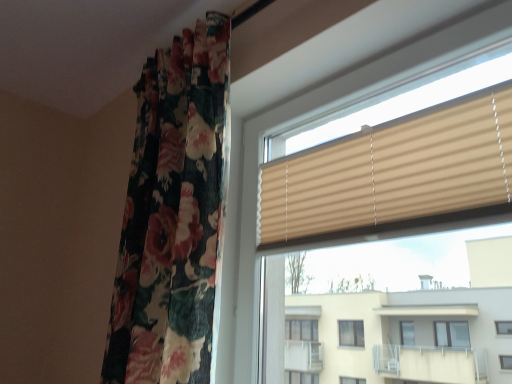
Question: In the image, is floral fabric curtain at left positioned in front of or behind beige ribbed blinds at center?

Choices:
 (A) behind
 (B) front

Answer: (A)

Question: In terms of height, does floral fabric curtain at left look taller or shorter compared to beige ribbed blinds at center?

Choices:
 (A) tall
 (B) short

Answer: (A)

Question: Estimate the real-world distances between objects in this image. Which object is farther from the floral fabric curtain at left?

Choices:
 (A) beige ribbed blind at upper right
 (B) beige ribbed blinds at center

Answer: (A)

Question: Considering the real-world distances, which object is farthest from the floral fabric curtain at left?

Choices:
 (A) beige ribbed blind at upper right
 (B) beige ribbed blinds at center

Answer: (A)